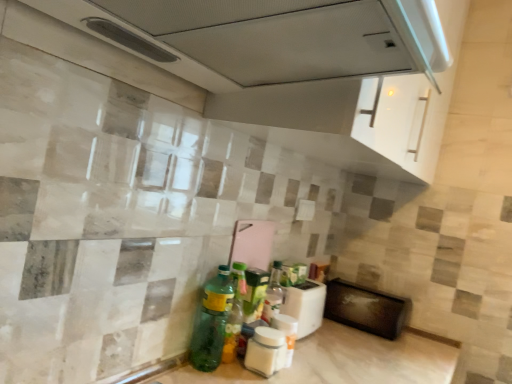
This screenshot has height=384, width=512. Describe the element at coordinates (290, 65) in the screenshot. I see `white glossy exhaust hood at upper center` at that location.

Locate an element on the screen. This screenshot has width=512, height=384. black matte microwave at lower right, positioned as the 2th appliance in front-to-back order is located at coordinates (365, 309).

Identify the location of translucent plastic bottle at center, acting as the third bottle starting from the left. The height and width of the screenshot is (384, 512). (286, 334).

The height and width of the screenshot is (384, 512). Identify the location of white matte jar at center, the 2th bottle from the right. (265, 351).

Describe the element at coordinates (265, 351) in the screenshot. I see `white matte jar at center, the 2th bottle from the right` at that location.

Locate an element on the screen. white glossy exhaust hood at upper center is located at coordinates [290, 65].

From a real-world perspective, is green glass bottle at lower center, the 1th bottle positioned from the left, above or below white plastic toaster at lower center, the second appliance in the right-to-left sequence?

Clearly, from a real-world perspective, green glass bottle at lower center, the 1th bottle positioned from the left, is above white plastic toaster at lower center, the second appliance in the right-to-left sequence.

Between green glass bottle at lower center, which is the 3th bottle in right-to-left order, and white plastic toaster at lower center, placed as the first appliance when sorted from left to right, which one is positioned behind?

white plastic toaster at lower center, placed as the first appliance when sorted from left to right, is behind.

Can white plastic toaster at lower center, placed as the first appliance when sorted from left to right, be found inside green glass bottle at lower center, the 1th bottle positioned from the left?

Actually, white plastic toaster at lower center, placed as the first appliance when sorted from left to right, is outside green glass bottle at lower center, the 1th bottle positioned from the left.

How different are the orientations of green glass bottle at lower center, which is the 3th bottle in right-to-left order, and white plastic toaster at lower center, placed as the first appliance when sorted from left to right, in degrees?

8.26 degrees separate the facing orientations of green glass bottle at lower center, which is the 3th bottle in right-to-left order, and white plastic toaster at lower center, placed as the first appliance when sorted from left to right.

Does white plastic toaster at lower center, the second appliance in the right-to-left sequence, appear on the right side of white glossy exhaust hood at upper center?

Yes, white plastic toaster at lower center, the second appliance in the right-to-left sequence, is to the right of white glossy exhaust hood at upper center.

Can you confirm if white plastic toaster at lower center, the 1th appliance viewed from the front, is thinner than white glossy exhaust hood at upper center?

Indeed, white plastic toaster at lower center, the 1th appliance viewed from the front, has a lesser width compared to white glossy exhaust hood at upper center.

Considering the sizes of objects white plastic toaster at lower center, the second appliance in the right-to-left sequence, and white glossy exhaust hood at upper center in the image provided, who is shorter, white plastic toaster at lower center, the second appliance in the right-to-left sequence, or white glossy exhaust hood at upper center?

Standing shorter between the two is white plastic toaster at lower center, the second appliance in the right-to-left sequence.

Which object is further away from the camera, white plastic toaster at lower center, the 2th appliance from the back, or white glossy exhaust hood at upper center?

white plastic toaster at lower center, the 2th appliance from the back.

The width and height of the screenshot is (512, 384). I want to click on bottle that appears below the translucent plastic bottle at center, which is the 1th bottle in right-to-left order (from the image's perspective), so click(x=265, y=351).

Considering the sizes of translucent plastic bottle at center, which is the 1th bottle in right-to-left order, and white matte jar at center, the 2th bottle from the right, in the image, is translucent plastic bottle at center, which is the 1th bottle in right-to-left order, wider or thinner than white matte jar at center, the 2th bottle from the right,?

translucent plastic bottle at center, which is the 1th bottle in right-to-left order, is thinner than white matte jar at center, the 2th bottle from the right.

Are translucent plastic bottle at center, acting as the third bottle starting from the left, and white matte jar at center, the 2th bottle from the right, far apart?

translucent plastic bottle at center, acting as the third bottle starting from the left, is actually quite close to white matte jar at center, the 2th bottle from the right.

Who is shorter, translucent plastic bottle at center, acting as the third bottle starting from the left, or white matte jar at center, which is counted as the second bottle, starting from the left?

white matte jar at center, which is counted as the second bottle, starting from the left, is shorter.

From a real-world perspective, which object stands above the other?

white plastic toaster at lower center, the 1th appliance viewed from the front.

Is white plastic toaster at lower center, the 2th appliance from the back, next to black matte microwave at lower right, which ranks as the second appliance in left-to-right order, and touching it?

No, white plastic toaster at lower center, the 2th appliance from the back, is not in contact with black matte microwave at lower right, which ranks as the second appliance in left-to-right order.

Find the location of `appliance that is in front of the black matte microwave at lower right, which ranks as the second appliance in left-to-right order`. appliance that is in front of the black matte microwave at lower right, which ranks as the second appliance in left-to-right order is located at coordinates (305, 305).

Is translucent plastic bottle at center, which is the 1th bottle in right-to-left order, positioned with its back to black matte microwave at lower right, which ranks as the second appliance in left-to-right order?

No, translucent plastic bottle at center, which is the 1th bottle in right-to-left order,'s orientation is not away from black matte microwave at lower right, which ranks as the second appliance in left-to-right order.

Based on their sizes in the image, would you say translucent plastic bottle at center, which is the 1th bottle in right-to-left order, is bigger or smaller than black matte microwave at lower right, the 1th appliance positioned from the back?

Considering their sizes, translucent plastic bottle at center, which is the 1th bottle in right-to-left order, takes up less space than black matte microwave at lower right, the 1th appliance positioned from the back.

Looking at their sizes, would you say translucent plastic bottle at center, acting as the third bottle starting from the left, is wider or thinner than black matte microwave at lower right, which ranks as the first appliance in right-to-left order?

In the image, translucent plastic bottle at center, acting as the third bottle starting from the left, appears to be more narrow than black matte microwave at lower right, which ranks as the first appliance in right-to-left order.

Would you consider translucent plastic bottle at center, acting as the third bottle starting from the left, to be distant from black matte microwave at lower right, which ranks as the second appliance in left-to-right order?

No, translucent plastic bottle at center, acting as the third bottle starting from the left, is not far away from black matte microwave at lower right, which ranks as the second appliance in left-to-right order.

Between white matte jar at center, which is counted as the second bottle, starting from the left, and white plastic toaster at lower center, the 1th appliance viewed from the front, which one has smaller width?

With smaller width is white matte jar at center, which is counted as the second bottle, starting from the left.

Is white matte jar at center, the 2th bottle from the right, in contact with white plastic toaster at lower center, the second appliance in the right-to-left sequence?

white matte jar at center, the 2th bottle from the right, and white plastic toaster at lower center, the second appliance in the right-to-left sequence, are clearly separated.

Considering the positions of points (283, 351) and (287, 312), is point (283, 351) closer to camera compared to point (287, 312)?

Yes, it is in front of point (287, 312).

Would you say white matte jar at center, which is counted as the second bottle, starting from the left, is to the left or to the right of white plastic toaster at lower center, the 1th appliance viewed from the front, in the picture?

From the image, it's evident that white matte jar at center, which is counted as the second bottle, starting from the left, is to the left of white plastic toaster at lower center, the 1th appliance viewed from the front.

Who is shorter, translucent plastic bottle at center, which is the 1th bottle in right-to-left order, or white glossy exhaust hood at upper center?

A: Standing shorter between the two is translucent plastic bottle at center, which is the 1th bottle in right-to-left order.

Does translucent plastic bottle at center, which is the 1th bottle in right-to-left order, have a lesser width compared to white glossy exhaust hood at upper center?

Correct, the width of translucent plastic bottle at center, which is the 1th bottle in right-to-left order, is less than that of white glossy exhaust hood at upper center.

From a real-world perspective, which is physically below, translucent plastic bottle at center, which is the 1th bottle in right-to-left order, or white glossy exhaust hood at upper center?

translucent plastic bottle at center, which is the 1th bottle in right-to-left order.

The image size is (512, 384). What are the coordinates of `appliance that is the 1st one below the green glass bottle at lower center, the 1th bottle positioned from the left (from a real-world perspective)` in the screenshot? It's located at (305, 305).

In the image, there is a white plastic toaster at lower center, placed as the first appliance when sorted from left to right. Where is `exhaust hood above it (from the image's perspective)`? Image resolution: width=512 pixels, height=384 pixels. exhaust hood above it (from the image's perspective) is located at coordinates (290, 65).

Looking at the image, which one is located further to green glass bottle at lower center, the 1th bottle positioned from the left, translucent plastic bottle at center, acting as the third bottle starting from the left, or black matte microwave at lower right, positioned as the 2th appliance in front-to-back order?

black matte microwave at lower right, positioned as the 2th appliance in front-to-back order.

Based on their spatial positions, is white glossy exhaust hood at upper center or green glass bottle at lower center, the 1th bottle positioned from the left, further from white plastic toaster at lower center, placed as the first appliance when sorted from left to right?

white glossy exhaust hood at upper center.

Based on their spatial positions, is black matte microwave at lower right, positioned as the 2th appliance in front-to-back order, or green glass bottle at lower center, which is the 3th bottle in right-to-left order, closer to translucent plastic bottle at center, acting as the third bottle starting from the left?

green glass bottle at lower center, which is the 3th bottle in right-to-left order, is positioned closer to the anchor translucent plastic bottle at center, acting as the third bottle starting from the left.

Based on their spatial positions, is green glass bottle at lower center, the 1th bottle positioned from the left, or white plastic toaster at lower center, placed as the first appliance when sorted from left to right, closer to black matte microwave at lower right, which ranks as the second appliance in left-to-right order?

Among the two, white plastic toaster at lower center, placed as the first appliance when sorted from left to right, is located nearer to black matte microwave at lower right, which ranks as the second appliance in left-to-right order.

Which object lies further to the anchor point green glass bottle at lower center, the 1th bottle positioned from the left, white plastic toaster at lower center, the second appliance in the right-to-left sequence, or translucent plastic bottle at center, which is the 1th bottle in right-to-left order?

Based on the image, white plastic toaster at lower center, the second appliance in the right-to-left sequence, appears to be further to green glass bottle at lower center, the 1th bottle positioned from the left.

Consider the image. From the image, which object appears to be farther from black matte microwave at lower right, which ranks as the first appliance in right-to-left order, white plastic toaster at lower center, the 2th appliance from the back, or white matte jar at center, the 2th bottle from the right?

white matte jar at center, the 2th bottle from the right.

From the image, which object appears to be farther from translucent plastic bottle at center, which is the 1th bottle in right-to-left order, black matte microwave at lower right, the 1th appliance positioned from the back, or white plastic toaster at lower center, placed as the first appliance when sorted from left to right?

Based on the image, black matte microwave at lower right, the 1th appliance positioned from the back, appears to be further to translucent plastic bottle at center, which is the 1th bottle in right-to-left order.

Consider the image. Considering their positions, is white matte jar at center, which is counted as the second bottle, starting from the left, positioned closer to white glossy exhaust hood at upper center than translucent plastic bottle at center, which is the 1th bottle in right-to-left order?

white matte jar at center, which is counted as the second bottle, starting from the left, lies closer to white glossy exhaust hood at upper center than the other object.

Identify the location of bottle between white matte jar at center, the 2th bottle from the right, and black matte microwave at lower right, which ranks as the second appliance in left-to-right order, from front to back. Image resolution: width=512 pixels, height=384 pixels. (286, 334).

Where is `appliance between translucent plastic bottle at center, which is the 1th bottle in right-to-left order, and black matte microwave at lower right, positioned as the 2th appliance in front-to-back order, from front to back`? appliance between translucent plastic bottle at center, which is the 1th bottle in right-to-left order, and black matte microwave at lower right, positioned as the 2th appliance in front-to-back order, from front to back is located at coordinates (305, 305).

I want to click on bottle located between white glossy exhaust hood at upper center and white matte jar at center, the 2th bottle from the right, in the depth direction, so click(x=211, y=322).

The height and width of the screenshot is (384, 512). In order to click on bottle between green glass bottle at lower center, which is the 3th bottle in right-to-left order, and translucent plastic bottle at center, which is the 1th bottle in right-to-left order, from left to right in this screenshot , I will do `click(265, 351)`.